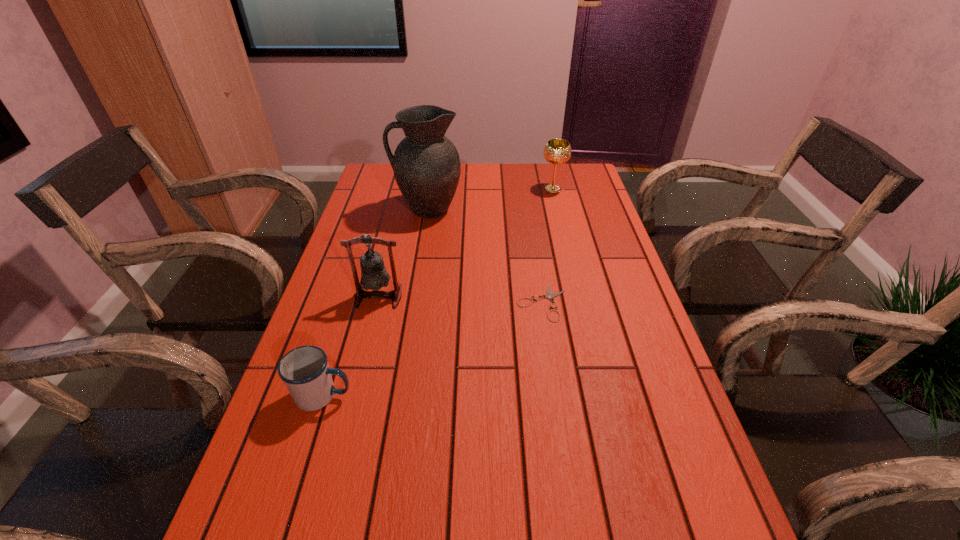
In the image, there is a desktop. Identify the location of blank space at the left edge. This screenshot has height=540, width=960. (385, 198).

In the image, there is a desktop. In order to click on free space at the right edge in this screenshot , I will do `click(692, 526)`.

In the image, there is a desktop. Identify the location of vacant space at the far left corner. (383, 174).

Where is `free space at the far right corner of the desktop`? This screenshot has height=540, width=960. free space at the far right corner of the desktop is located at coordinates (575, 171).

Find the location of a particular element. vacant area between the bell and the chalice is located at coordinates (467, 243).

Where is `vacant region between the shears and the chalice`? vacant region between the shears and the chalice is located at coordinates [547, 246].

This screenshot has height=540, width=960. Find the location of `empty location between the bell and the pitcher`. empty location between the bell and the pitcher is located at coordinates (x=403, y=253).

At what (x,y) coordinates should I click in order to perform the action: click on free space between the chalice and the tallest object. Please return your answer as a coordinate pair (x, y). The width and height of the screenshot is (960, 540). Looking at the image, I should click on (491, 199).

The height and width of the screenshot is (540, 960). I want to click on vacant point located between the shears and the chalice, so click(547, 246).

This screenshot has width=960, height=540. I want to click on free spot between the bell and the mug, so click(x=351, y=346).